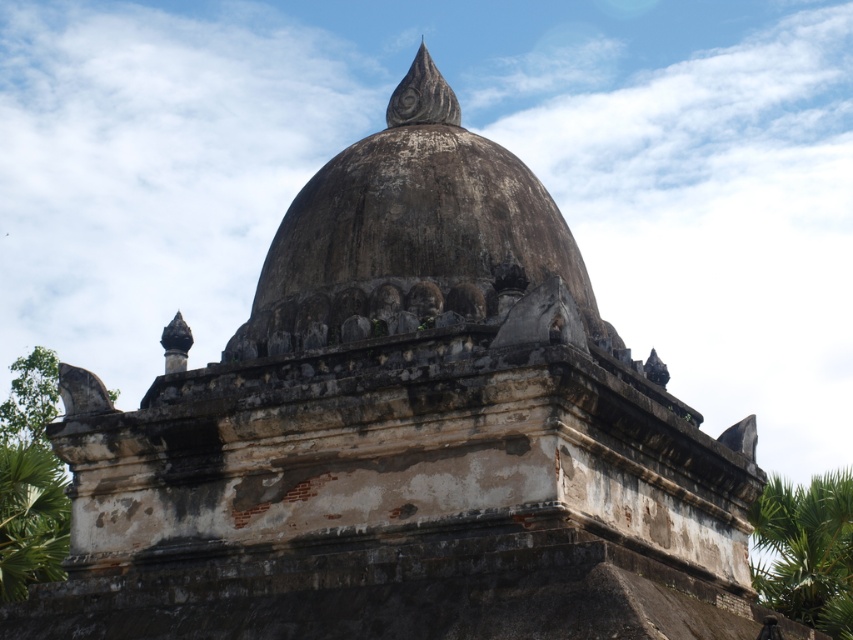
You are an architect analyzing the symmetry of the dome structure. Considering the placement and size of the green leafy palm tree at right and the green leafy palm tree at lower left, which one would you say is larger?

The green leafy palm tree at right is bigger than the green leafy palm tree at lower left according to the description.

You are an architect examining the image of an ancient structure. You notice the weathered stone dome at center and the green leafy palm tree at lower left. Based on their sizes in the image, which object would you estimate to be closer to the viewer?

The green leafy palm tree at lower left is larger in the image, so it is closer to the viewer than the weathered stone dome at center.